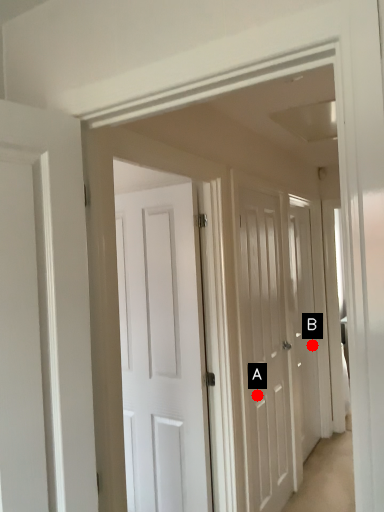
Question: Two points are circled on the image, labeled by A and B beside each circle. Among these points, which one is nearest to the camera?

Choices:
 (A) A is closer
 (B) B is closer

Answer: (A)